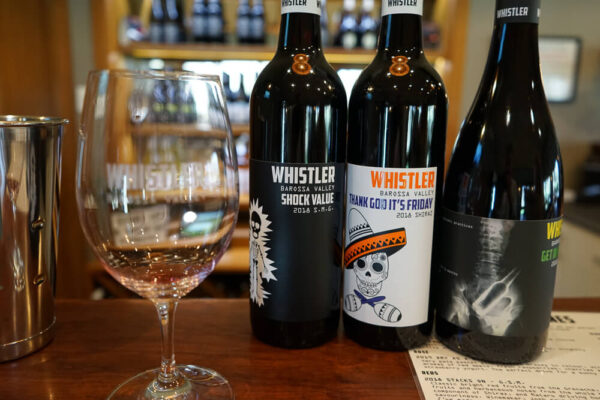
The height and width of the screenshot is (400, 600). In order to click on door in this screenshot , I will do `click(568, 122)`.